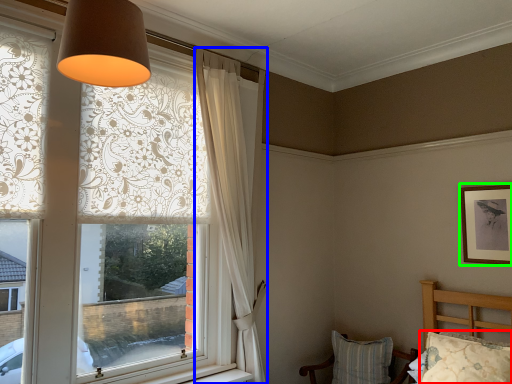
Question: Which object is positioned farthest from pillow (highlighted by a red box)? Select from curtain (highlighted by a blue box) and picture frame (highlighted by a green box).

Choices:
 (A) curtain
 (B) picture frame

Answer: (A)